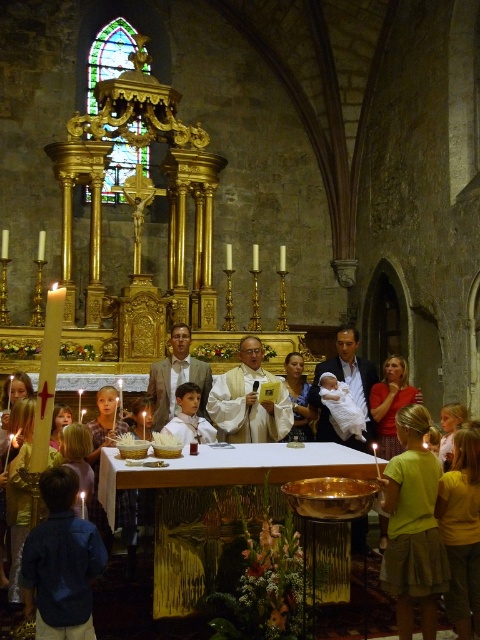
Between gold polished table at center and white satin robe at center, which one appears on the left side from the viewer's perspective?

Answer: From the viewer's perspective, white satin robe at center appears more on the left side.

Can you confirm if gold polished table at center is positioned to the left of white satin robe at center?

No, gold polished table at center is not to the left of white satin robe at center.

At what (x,y) coordinates should I click in order to perform the action: click on gold polished table at center. Please return your answer as a coordinate pair (x, y). Looking at the image, I should click on (214, 504).

Does point (188, 497) come farther from viewer compared to point (61, 528)?

Yes.

The image size is (480, 640). What do you see at coordinates (214, 504) in the screenshot?
I see `gold polished table at center` at bounding box center [214, 504].

Who is more distant from viewer, (165, 492) or (51, 557)?

Positioned behind is point (165, 492).

You are a GUI agent. You are given a task and a screenshot of the screen. Output one action in this format:
    pyautogui.click(x=<x>, y=<y>)
    Task: Click on the gold polished table at center
    Image resolution: width=480 pixels, height=640 pixels.
    Given the screenshot: What is the action you would take?
    pyautogui.click(x=214, y=504)

Is point (83, 561) less distant than point (167, 428)?

Yes.

Is blue denim shirt at lower left thinner than white satin robe at center?

No.

I want to click on blue denim shirt at lower left, so click(60, 563).